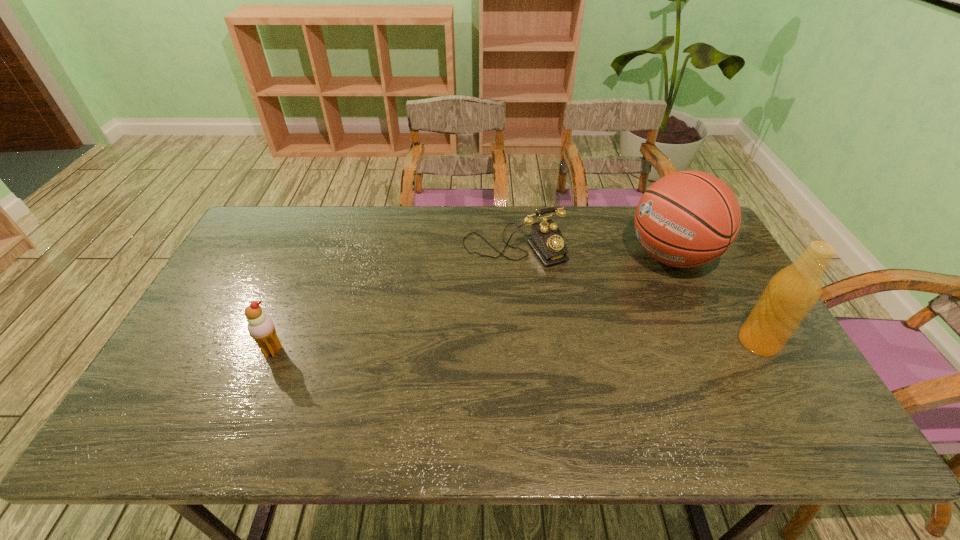
Where is `vacant space located on the dial of the third object from right to left`? Image resolution: width=960 pixels, height=540 pixels. vacant space located on the dial of the third object from right to left is located at coordinates (584, 338).

The width and height of the screenshot is (960, 540). In order to click on vacant region located on the logo side of the basketball in this screenshot , I will do `click(568, 314)`.

This screenshot has height=540, width=960. I want to click on free space located on the logo side of the basketball, so click(543, 327).

Locate an element on the screen. This screenshot has height=540, width=960. free space located 0.270m on the logo side of the basketball is located at coordinates (576, 309).

The width and height of the screenshot is (960, 540). Find the location of `telephone that is at the far edge`. telephone that is at the far edge is located at coordinates (546, 239).

Image resolution: width=960 pixels, height=540 pixels. Identify the location of basketball at the far edge. (686, 219).

The width and height of the screenshot is (960, 540). Identify the location of beer bottle located at the right edge. (792, 292).

At what (x,y) coordinates should I click in order to perform the action: click on basketball at the right edge. Please return your answer as a coordinate pair (x, y). Looking at the image, I should click on click(x=686, y=219).

You are a GUI agent. You are given a task and a screenshot of the screen. Output one action in this format:
    pyautogui.click(x=<x>, y=<y>)
    Task: Click on the object situated at the far right corner
    
    Given the screenshot: What is the action you would take?
    pyautogui.click(x=686, y=219)

Where is `free spot at the far edge of the desktop`? free spot at the far edge of the desktop is located at coordinates point(392,248).